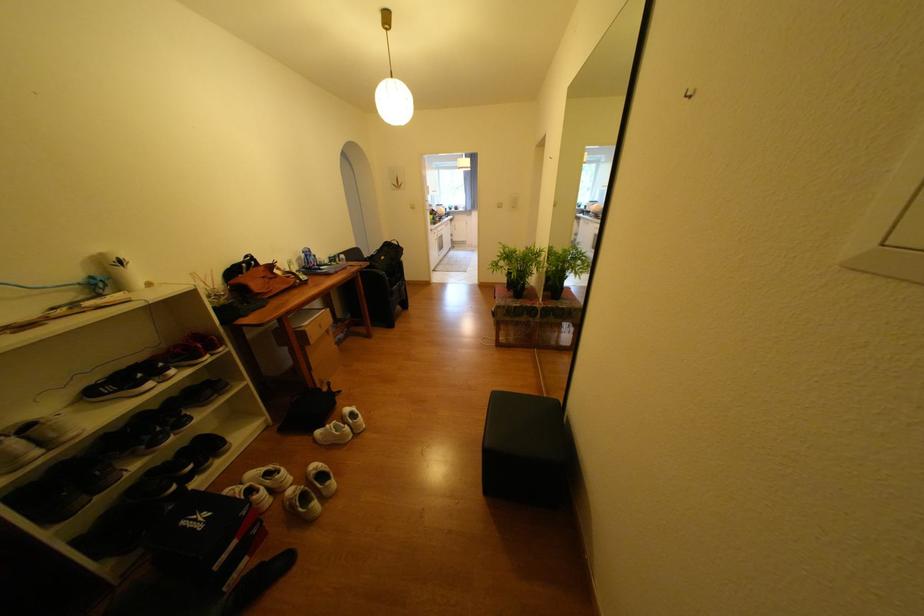
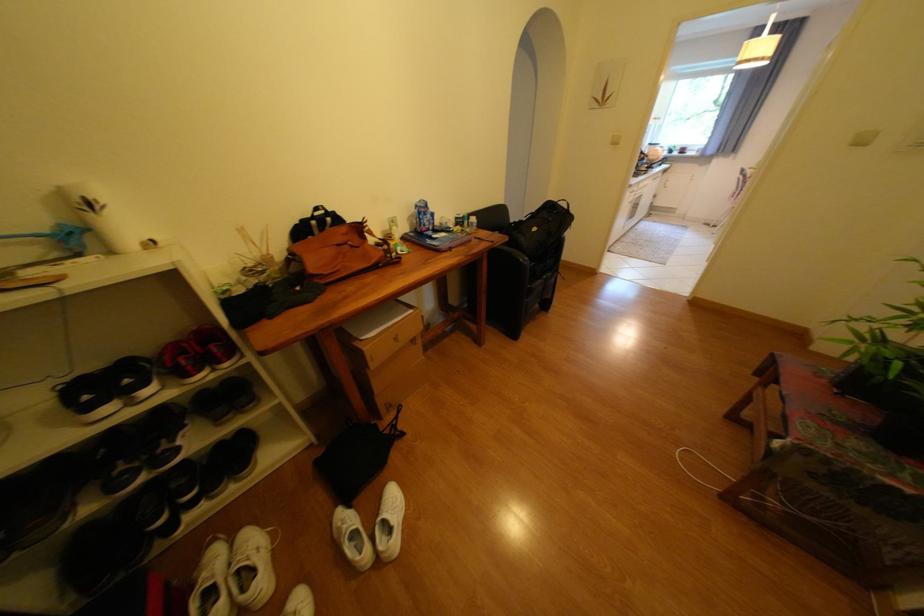
Find the pixel in the second image that matches (392,257) in the first image.

(543, 230)